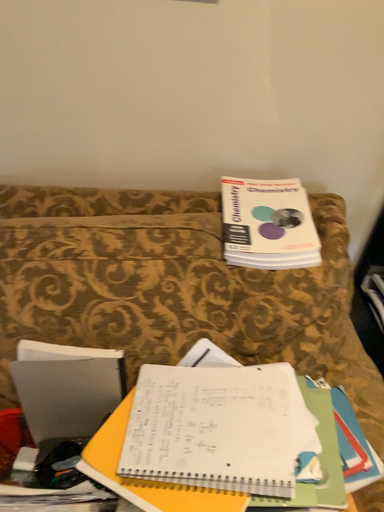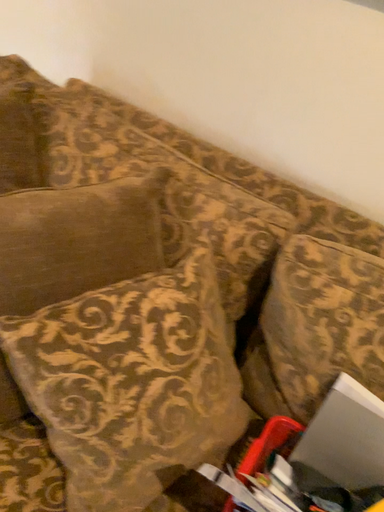
Question: How did the camera likely rotate when shooting the video?

Choices:
 (A) rotated right
 (B) rotated left

Answer: (B)